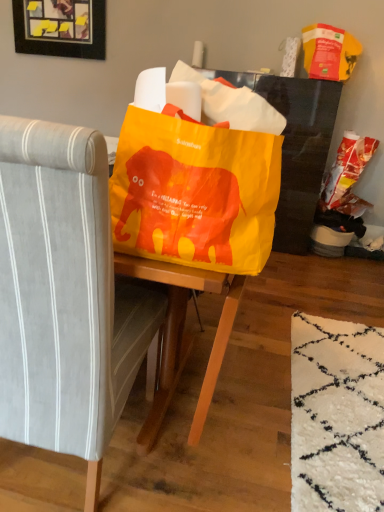
Question: Does gray fabric chair at center lie behind wooden frame with yellow sticky notes at upper left?

Choices:
 (A) yes
 (B) no

Answer: (B)

Question: Considering the relative sizes of gray fabric chair at center and wooden frame with yellow sticky notes at upper left in the image provided, is gray fabric chair at center taller than wooden frame with yellow sticky notes at upper left?

Choices:
 (A) no
 (B) yes

Answer: (B)

Question: Is gray fabric chair at center wider than wooden frame with yellow sticky notes at upper left?

Choices:
 (A) no
 (B) yes

Answer: (B)

Question: From the image's perspective, is gray fabric chair at center on wooden frame with yellow sticky notes at upper left?

Choices:
 (A) yes
 (B) no

Answer: (B)

Question: Is gray fabric chair at center shorter than wooden frame with yellow sticky notes at upper left?

Choices:
 (A) yes
 (B) no

Answer: (B)

Question: From the image's perspective, would you say gray fabric chair at center is shown under wooden frame with yellow sticky notes at upper left?

Choices:
 (A) yes
 (B) no

Answer: (A)

Question: Is gray fabric chair at center positioned in front of yellow plastic grocery bag at upper right, arranged as the first grocery bag when viewed from the top?

Choices:
 (A) yes
 (B) no

Answer: (A)

Question: Is gray fabric chair at center located outside yellow plastic grocery bag at upper right, acting as the 2th grocery bag starting from the bottom?

Choices:
 (A) no
 (B) yes

Answer: (B)

Question: Is gray fabric chair at center taller than yellow plastic grocery bag at upper right, arranged as the first grocery bag when viewed from the top?

Choices:
 (A) no
 (B) yes

Answer: (B)

Question: Can you confirm if gray fabric chair at center is wider than yellow plastic grocery bag at upper right, arranged as the first grocery bag when viewed from the top?

Choices:
 (A) no
 (B) yes

Answer: (B)

Question: Are gray fabric chair at center and yellow plastic grocery bag at upper right, acting as the 2th grocery bag starting from the bottom, located far from each other?

Choices:
 (A) yes
 (B) no

Answer: (A)

Question: From a real-world perspective, is gray fabric chair at center on top of yellow plastic grocery bag at upper right, acting as the 2th grocery bag starting from the bottom?

Choices:
 (A) no
 (B) yes

Answer: (A)

Question: Can you confirm if wooden frame with yellow sticky notes at upper left is positioned to the left of yellow plastic grocery bag at upper right, arranged as the first grocery bag when viewed from the top?

Choices:
 (A) yes
 (B) no

Answer: (A)